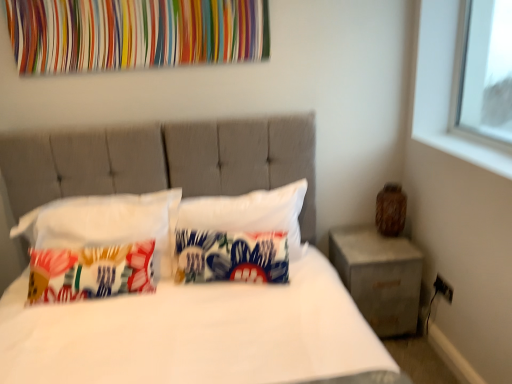
Question: Looking at the image, does printed fabric pillow at left, marked as the third pillow in a right-to-left arrangement, seem bigger or smaller compared to concrete/rough concrete nightstand at right?

Choices:
 (A) big
 (B) small

Answer: (B)

Question: Is printed fabric pillow at left, marked as the 1th pillow in a left-to-right arrangement, wider or thinner than concrete/rough concrete nightstand at right?

Choices:
 (A) wide
 (B) thin

Answer: (B)

Question: Which of these objects is positioned closest to the white fabric bed at center?

Choices:
 (A) multicolored fabric at upper center
 (B) printed fabric pillow at left, marked as the third pillow in a right-to-left arrangement
 (C) concrete/rough concrete nightstand at right
 (D) printed fabric pillow at center, the 2th pillow positioned from the right
 (E) white fabric pillow at center, the third pillow when ordered from left to right

Answer: (D)

Question: Which object is the closest to the printed fabric pillow at left, marked as the third pillow in a right-to-left arrangement?

Choices:
 (A) white fabric bed at center
 (B) concrete/rough concrete nightstand at right
 (C) white fabric pillow at center, the third pillow when ordered from left to right
 (D) printed fabric pillow at center, the 2th pillow positioned from the right
 (E) multicolored fabric at upper center

Answer: (D)